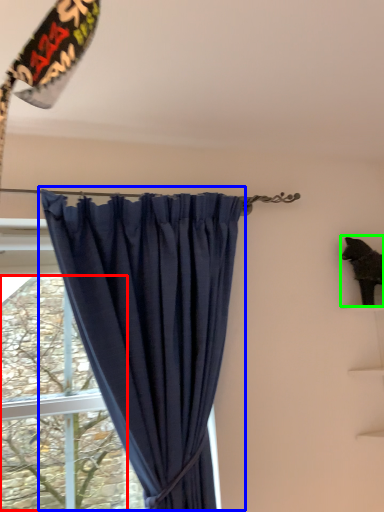
Question: Based on their relative distances, which object is farther from tree (highlighted by a red box)? Choose from curtain (highlighted by a blue box) and animal (highlighted by a green box).

Choices:
 (A) curtain
 (B) animal

Answer: (B)